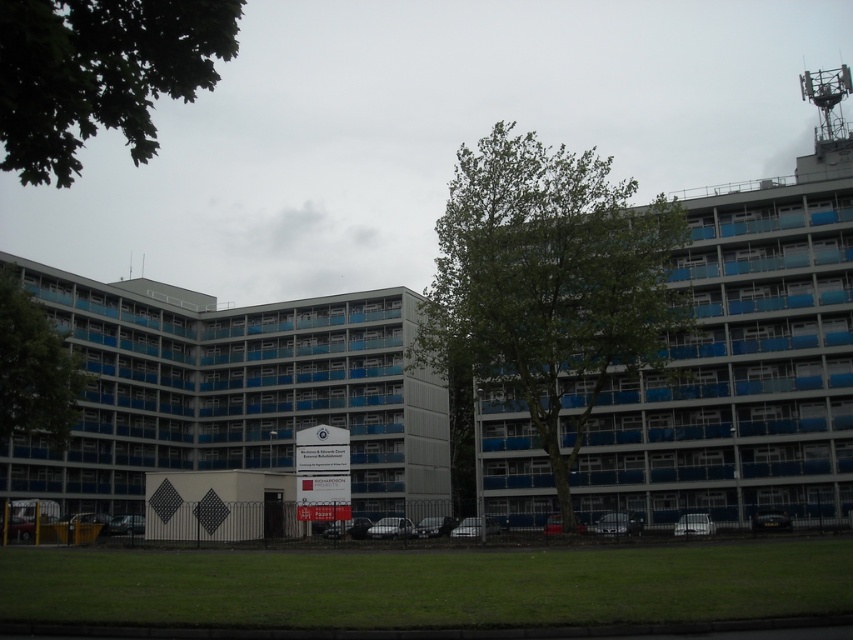
You are a drone operator planning to take a photo of the green leafy tree at upper left from above. What are the coordinates of the tree to ensure precise targeting?

The green leafy tree at upper left is located at coordinates 0.116 on the x axis and 0.118 on the y axis.